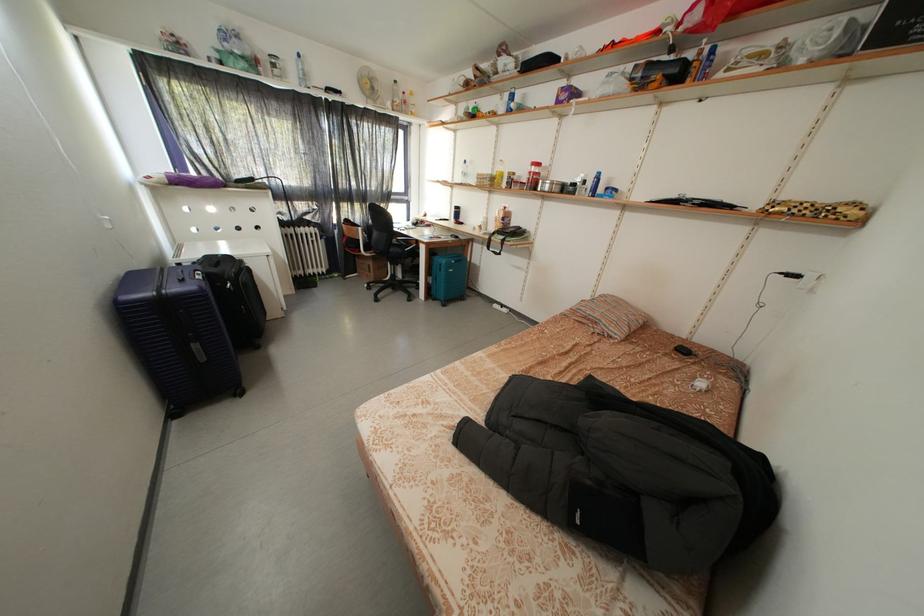
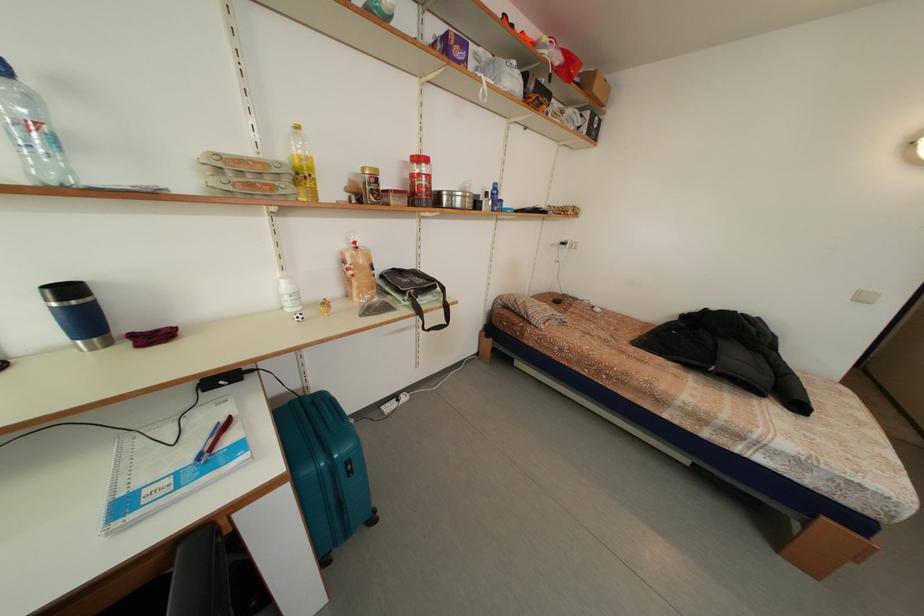
In the second image, find the point that corresponds to (475,172) in the first image.

(40, 106)